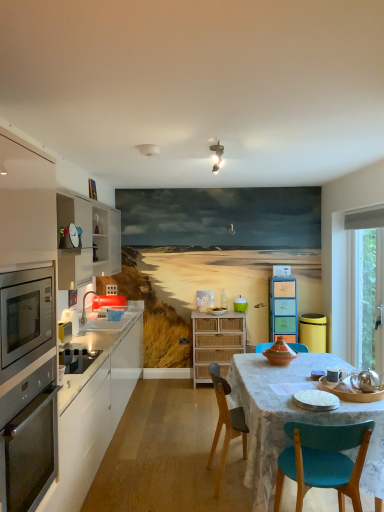
Locate an element on the screen. vacant area on top of white marble table at center (from a real-world perspective) is located at coordinates (303, 375).